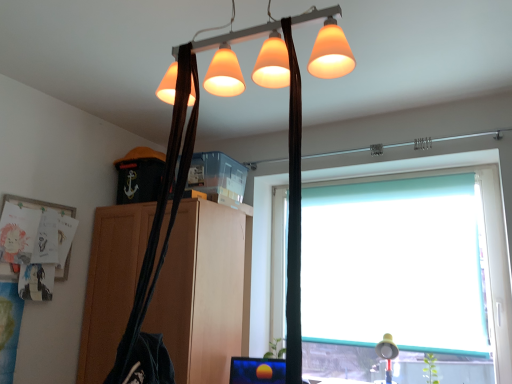
The width and height of the screenshot is (512, 384). Describe the element at coordinates (387, 354) in the screenshot. I see `matte white lampshade at lower right` at that location.

What is the approximate width of wooden cabinet at center?

26.79 inches.

Locate an element on the screen. teal roller blind at right is located at coordinates (261, 263).

Is matte orange lampshade at upper center outside of wooden cabinet at center?

matte orange lampshade at upper center lies outside wooden cabinet at center's area.

Is matte orange lampshade at upper center wider or thinner than wooden cabinet at center?

matte orange lampshade at upper center is thinner than wooden cabinet at center.

The width and height of the screenshot is (512, 384). I want to click on cabinetry below the matte orange lampshade at upper center (from a real-world perspective), so click(x=201, y=292).

Is matte orange lampshade at upper center aimed at wooden cabinet at center?

No, matte orange lampshade at upper center is not turned towards wooden cabinet at center.

From a real-world perspective, is matte white lampshade at lower right located beneath matte orange lampshade at upper center?

Yes, from a real-world perspective, matte white lampshade at lower right is below matte orange lampshade at upper center.

From the picture: Is matte white lampshade at lower right smaller than matte orange lampshade at upper center?

Correct, matte white lampshade at lower right occupies less space than matte orange lampshade at upper center.

Is the position of matte white lampshade at lower right more distant than that of matte orange lampshade at upper center?

Yes, matte white lampshade at lower right is further from the camera.

Which object is wider, wooden cabinet at center or matte white lampshade at lower right?

wooden cabinet at center.

Between wooden cabinet at center and matte white lampshade at lower right, which one has less height?

With less height is matte white lampshade at lower right.

Is wooden cabinet at center inside the boundaries of matte white lampshade at lower right, or outside?

The correct answer is: outside.

Is point (348, 47) positioned in front of point (384, 356)?

Yes, point (348, 47) is closer to viewer.

Based on the photo, is matte orange lampshade at upper center to the right of matte white lampshade at lower right from the viewer's perspective?

No.

From a real-world perspective, is teal roller blind at right physically above matte white lampshade at lower right?

Yes, from a real-world perspective, teal roller blind at right is above matte white lampshade at lower right.

Considering the sizes of objects teal roller blind at right and matte white lampshade at lower right in the image provided, who is shorter, teal roller blind at right or matte white lampshade at lower right?

matte white lampshade at lower right.

What's the angular difference between teal roller blind at right and matte white lampshade at lower right's facing directions?

The angular difference between teal roller blind at right and matte white lampshade at lower right is 1.25 degrees.

In the scene shown: Is teal roller blind at right behind matte white lampshade at lower right?

No.

Does matte white lampshade at lower right have a larger size compared to wooden cabinet at center?

No, matte white lampshade at lower right is not bigger than wooden cabinet at center.

From a real-world perspective, which object rests below the other?

matte white lampshade at lower right, from a real-world perspective.

Can you tell me how much matte white lampshade at lower right and wooden cabinet at center differ in facing direction?

1.67 degrees.

This screenshot has width=512, height=384. I want to click on cabinetry on the left of matte white lampshade at lower right, so click(201, 292).

Is wooden cabinet at center touching matte orange lampshade at upper center?

No, wooden cabinet at center is not with matte orange lampshade at upper center.

Is wooden cabinet at center bigger or smaller than matte orange lampshade at upper center?

Clearly, wooden cabinet at center is larger in size than matte orange lampshade at upper center.

Could you tell me if wooden cabinet at center is turned towards matte orange lampshade at upper center?

No, wooden cabinet at center is not facing towards matte orange lampshade at upper center.

The height and width of the screenshot is (384, 512). I want to click on cabinetry that appears behind the matte orange lampshade at upper center, so click(201, 292).

Find the location of a particular element. lamp that is above the matte white lampshade at lower right (from a real-world perspective) is located at coordinates (259, 54).

In the scene shown: Estimate the real-world distances between objects in this image. Which object is further from wooden cabinet at center, matte white lampshade at lower right or teal roller blind at right?

The object further to wooden cabinet at center is matte white lampshade at lower right.

Based on their spatial positions, is wooden cabinet at center or matte orange lampshade at upper center closer to teal roller blind at right?

Among the two, wooden cabinet at center is located nearer to teal roller blind at right.

From the image, which object appears to be farther from wooden cabinet at center, matte white lampshade at lower right or matte orange lampshade at upper center?

Among the two, matte orange lampshade at upper center is located further to wooden cabinet at center.

Based on their spatial positions, is wooden cabinet at center or teal roller blind at right closer to matte orange lampshade at upper center?

wooden cabinet at center lies closer to matte orange lampshade at upper center than the other object.

Considering their positions, is wooden cabinet at center positioned closer to matte orange lampshade at upper center than matte white lampshade at lower right?

wooden cabinet at center is closer to matte orange lampshade at upper center.

Based on their spatial positions, is matte orange lampshade at upper center or teal roller blind at right further from matte white lampshade at lower right?

matte orange lampshade at upper center lies further to matte white lampshade at lower right than the other object.

When comparing their distances from wooden cabinet at center, does teal roller blind at right or matte orange lampshade at upper center seem closer?

The object closer to wooden cabinet at center is teal roller blind at right.

Which object lies further to the anchor point teal roller blind at right, wooden cabinet at center or matte white lampshade at lower right?

Among the two, matte white lampshade at lower right is located further to teal roller blind at right.

At what (x,y) coordinates should I click in order to perform the action: click on window located between matte orange lampshade at upper center and matte white lampshade at lower right in the depth direction. Please return your answer as a coordinate pair (x, y). The width and height of the screenshot is (512, 384). Looking at the image, I should click on (261, 263).

Locate an element on the screen. The width and height of the screenshot is (512, 384). table lamp between wooden cabinet at center and teal roller blind at right in the horizontal direction is located at coordinates (387, 354).

You are a GUI agent. You are given a task and a screenshot of the screen. Output one action in this format:
    pyautogui.click(x=<x>, y=<y>)
    Task: Click on the cabinetry between matte orange lampshade at upper center and matte white lampshade at lower right in the vertical direction
    The width and height of the screenshot is (512, 384).
    Given the screenshot: What is the action you would take?
    pyautogui.click(x=201, y=292)

Where is `cabinetry located between matte orange lampshade at upper center and teal roller blind at right in the depth direction`? cabinetry located between matte orange lampshade at upper center and teal roller blind at right in the depth direction is located at coordinates (201, 292).